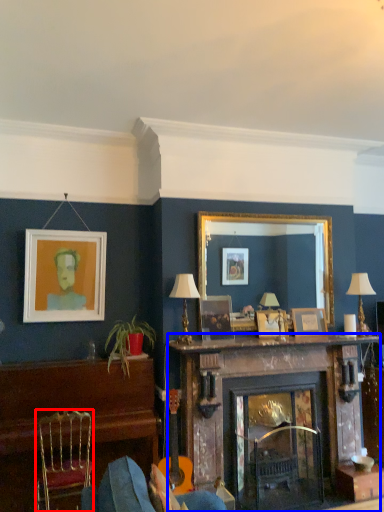
Question: Which object is further to the camera taking this photo, chair (highlighted by a red box) or fireplace (highlighted by a blue box)?

Choices:
 (A) chair
 (B) fireplace

Answer: (B)